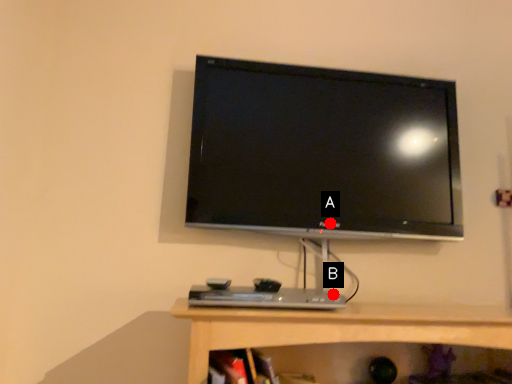
Question: Two points are circled on the image, labeled by A and B beside each circle. Which of the following is the closest to the observer?

Choices:
 (A) A is closer
 (B) B is closer

Answer: (B)